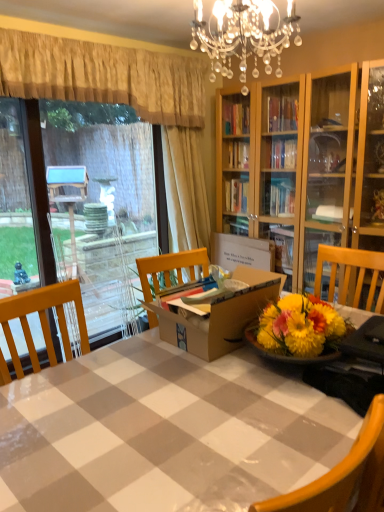
Identify the location of free space above white glossy table at center (from a real-world perspective). The image size is (384, 512). (196, 408).